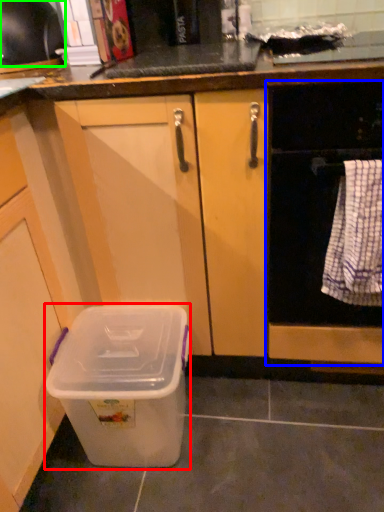
Question: Which is farther away from storage box (highlighted by a red box)? home appliance (highlighted by a blue box) or kitchen appliance (highlighted by a green box)?

Choices:
 (A) home appliance
 (B) kitchen appliance

Answer: (B)